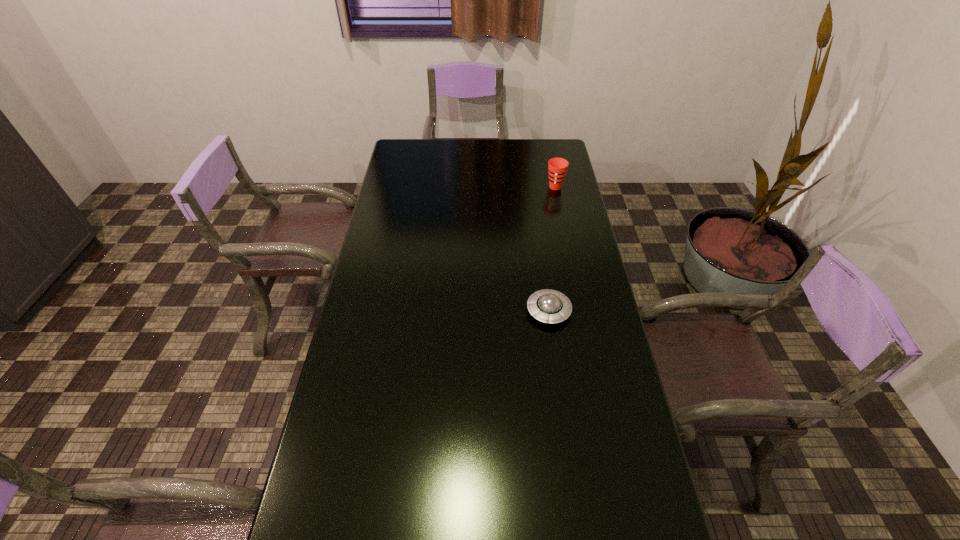
The image size is (960, 540). Identify the location of cup. (557, 167).

Image resolution: width=960 pixels, height=540 pixels. What are the coordinates of `the taller object` in the screenshot? It's located at (557, 167).

You are a GUI agent. You are given a task and a screenshot of the screen. Output one action in this format:
    pyautogui.click(x=<x>, y=<y>)
    Task: Click on the nearer object
    The height and width of the screenshot is (540, 960).
    Given the screenshot: What is the action you would take?
    pyautogui.click(x=550, y=306)

Where is `the shorter object`? the shorter object is located at coordinates (550, 306).

Find the location of a particular element. vacant region located 0.240m on the left of the farther object is located at coordinates (489, 187).

The width and height of the screenshot is (960, 540). I want to click on free space located on the front of the nearer object, so 557,365.

You are a GUI agent. You are given a task and a screenshot of the screen. Output one action in this format:
    pyautogui.click(x=<x>, y=<y>)
    Task: Click on the cup present at the right edge
    
    Given the screenshot: What is the action you would take?
    pyautogui.click(x=557, y=167)

Locate an element on the screen. saucer that is at the right edge is located at coordinates (550, 306).

The image size is (960, 540). I want to click on free space at the far edge of the desktop, so click(x=511, y=148).

You are a GUI agent. You are given a task and a screenshot of the screen. Output one action in this format:
    pyautogui.click(x=<x>, y=<y>)
    Task: Click on the vacant region at the left edge of the desktop
    The height and width of the screenshot is (540, 960).
    Given the screenshot: What is the action you would take?
    pyautogui.click(x=414, y=183)